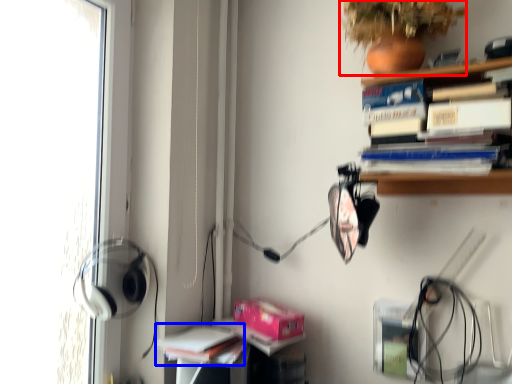
Question: Among these objects, which one is farthest to the camera, plant (highlighted by a red box) or book (highlighted by a blue box)?

Choices:
 (A) plant
 (B) book

Answer: (B)